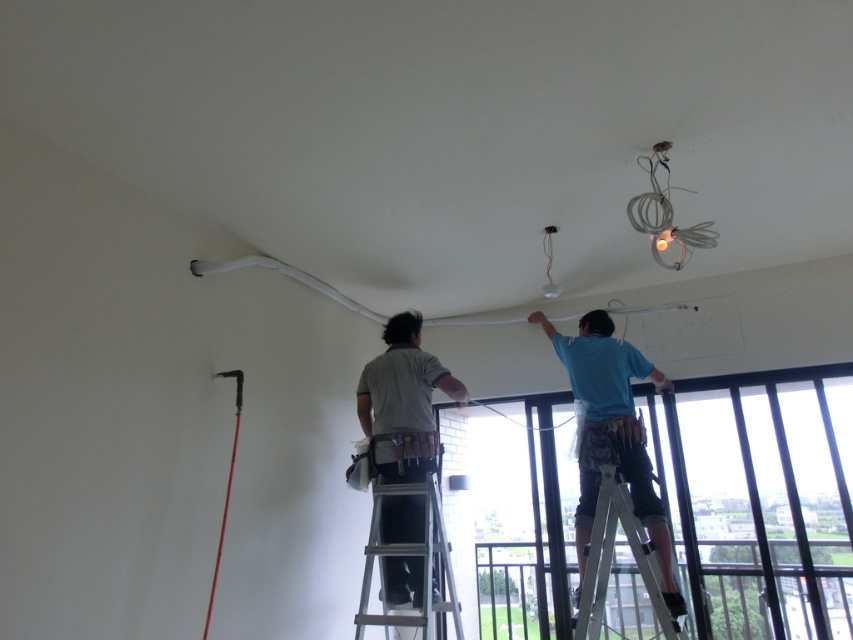
Describe the element at coordinates (402, 401) in the screenshot. I see `gray fabric shirt at center` at that location.

Who is positioned more to the right, gray fabric shirt at center or silver metallic ladder at center?

From the viewer's perspective, silver metallic ladder at center appears more on the right side.

Find the location of a particular element. gray fabric shirt at center is located at coordinates (402, 401).

Is point (581, 451) closer to camera compared to point (410, 397)?

That is False.

Is blue fabric shirt at upper center above gray fabric shirt at center?

Correct, blue fabric shirt at upper center is located above gray fabric shirt at center.

I want to click on blue fabric shirt at upper center, so click(x=612, y=435).

This screenshot has width=853, height=640. In order to click on blue fabric shirt at upper center in this screenshot , I will do `click(612, 435)`.

Is gray fabric shirt at center to the right of white metallic ladder at lower right from the viewer's perspective?

Incorrect, gray fabric shirt at center is not on the right side of white metallic ladder at lower right.

Is gray fabric shirt at center shorter than white metallic ladder at lower right?

In fact, gray fabric shirt at center may be taller than white metallic ladder at lower right.

What do you see at coordinates (402, 401) in the screenshot?
I see `gray fabric shirt at center` at bounding box center [402, 401].

Image resolution: width=853 pixels, height=640 pixels. Find the location of `gray fabric shirt at center`. gray fabric shirt at center is located at coordinates (402, 401).